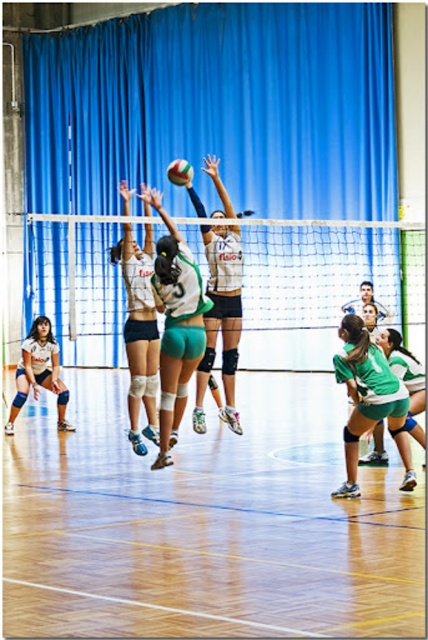
Question: Does white mesh net at center come behind white jersey at center?

Choices:
 (A) no
 (B) yes

Answer: (A)

Question: Which of the following is the closest to the observer?

Choices:
 (A) (119, 248)
 (B) (357, 422)

Answer: (B)

Question: Among these points, which one is farthest from the camera?

Choices:
 (A) (148, 241)
 (B) (53, 372)
 (C) (199, 424)

Answer: (B)

Question: Is white mesh net at center positioned at the back of white jersey at center?

Choices:
 (A) no
 (B) yes

Answer: (A)

Question: Does blue fabric curtain at upper center appear on the right side of white mesh net at center?

Choices:
 (A) yes
 (B) no

Answer: (B)

Question: Which object is closer to the camera taking this photo?

Choices:
 (A) green matte shorts at center
 (B) matte beige uniform at lower left
 (C) white matte volleyball at center
 (D) white jersey at center

Answer: (A)